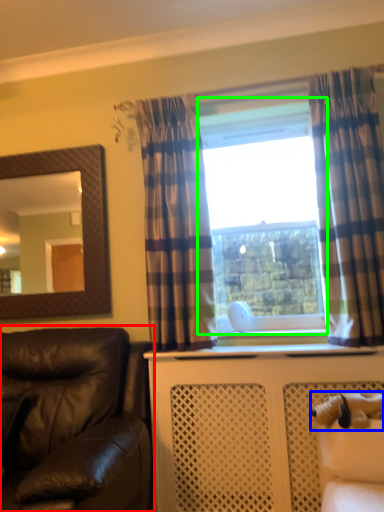
Question: Which is farther away from studio couch (highlighted by a red box)? animal (highlighted by a blue box) or window frame (highlighted by a green box)?

Choices:
 (A) animal
 (B) window frame

Answer: (B)